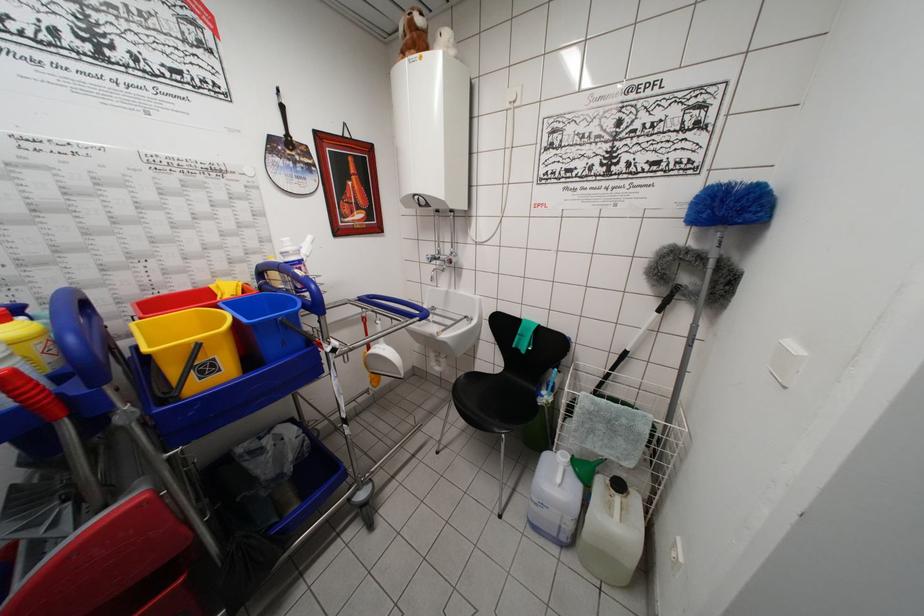
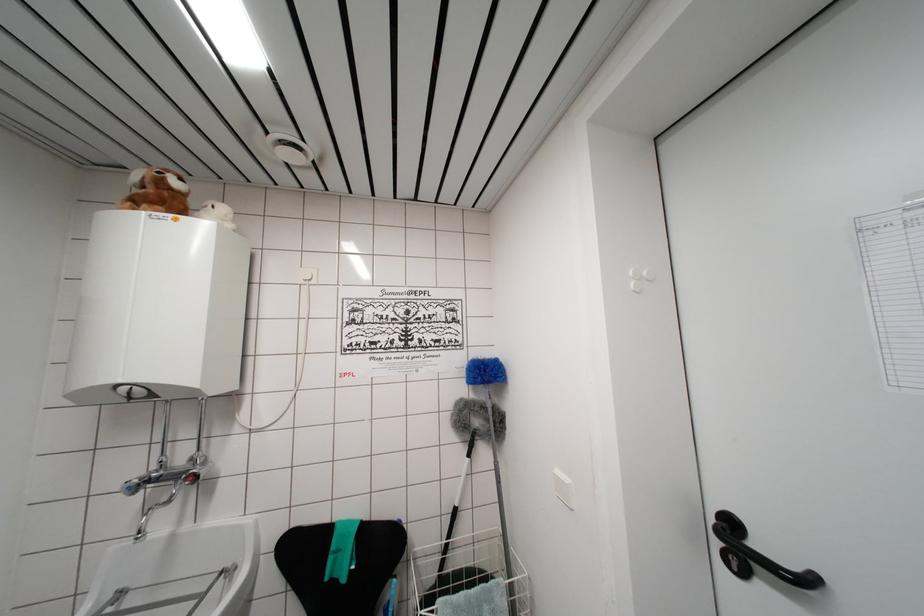
Where in the second image is the point corresponding to pixel 419 52 from the first image?

(168, 209)